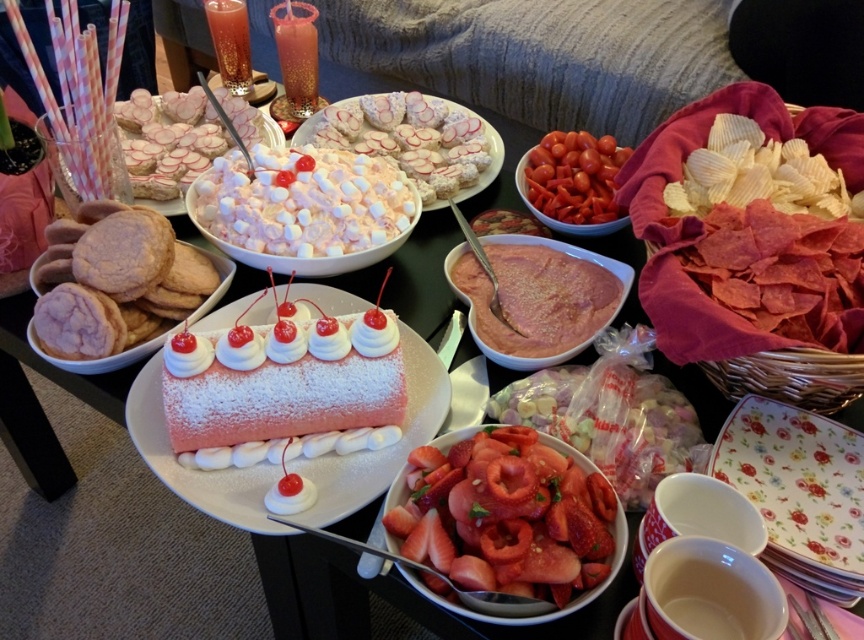
Looking at this image, what is located at the coordinate point (575, 177) in the image?

The point at coordinate (575, 177) is on the red glossy cherry tomatoes at center.

You are planning to place a 10 inch cake in the center of the table. Considering the powdered sugar cookies at center and the red glossy cherry tomatoes at center, will there be enough space between them to fit the cake?

The powdered sugar cookies at center and the red glossy cherry tomatoes at center are 7.54 inches apart. Since the cake is 10 inches wide, there isn